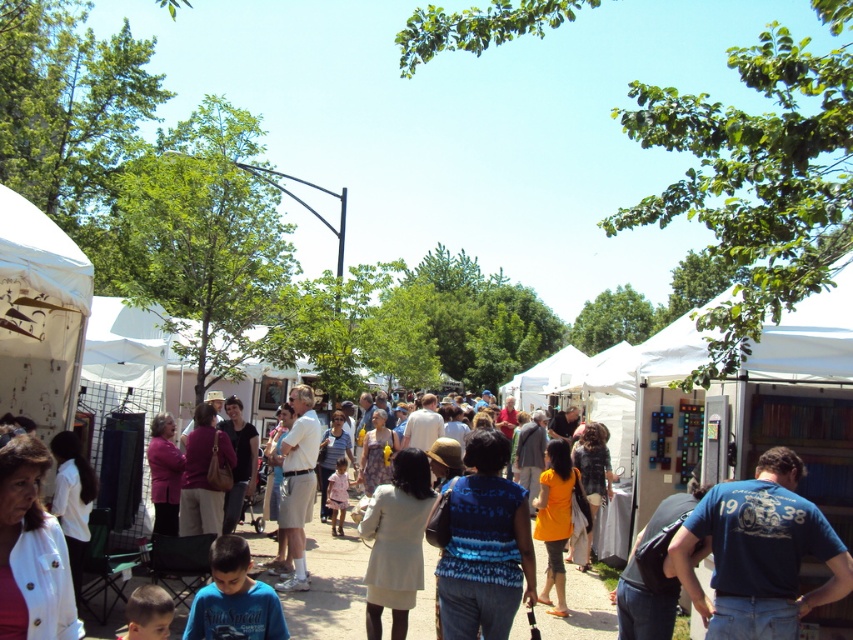
Question: Based on their relative distances, which object is nearer to the light brown fabric crowd at center?

Choices:
 (A) blue patterned shirt at center
 (B) light beige shorts at center

Answer: (B)

Question: Is blue cotton t-shirt at center-right above blue patterned shirt at center?

Choices:
 (A) no
 (B) yes

Answer: (B)

Question: Among these points, which one is farthest from the camera?

Choices:
 (A) (300, 595)
 (B) (753, 636)
 (C) (297, 449)

Answer: (C)

Question: Does blue cotton t-shirt at center-right appear over light beige shorts at center?

Choices:
 (A) yes
 (B) no

Answer: (A)

Question: Which object is closer to the camera taking this photo?

Choices:
 (A) blue patterned shirt at center
 (B) blue cotton t-shirt at center-right
 (C) light brown fabric crowd at center
 (D) light beige shorts at center

Answer: (B)

Question: Is light brown fabric crowd at center thinner than light beige shorts at center?

Choices:
 (A) no
 (B) yes

Answer: (A)